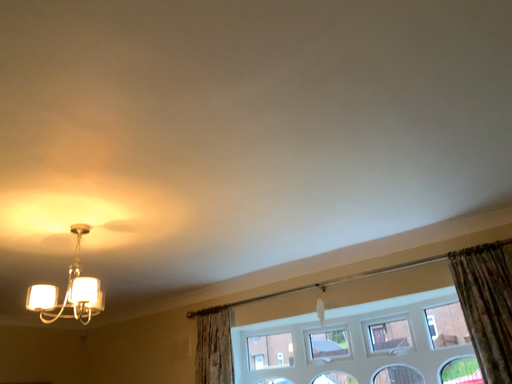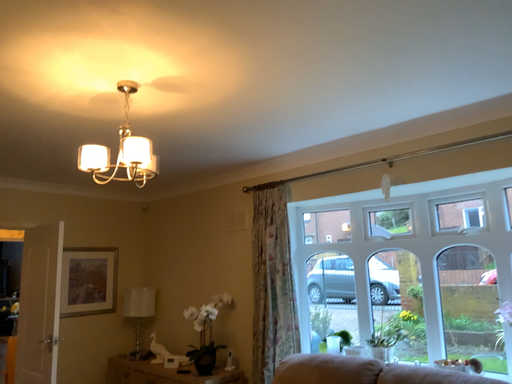
Question: Which way did the camera rotate in the video?

Choices:
 (A) rotated upward
 (B) rotated downward

Answer: (B)